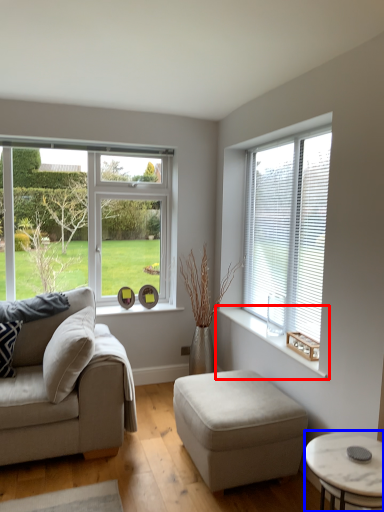
Question: Among these objects, which one is nearest to the camera, window sill (highlighted by a red box) or coffee table (highlighted by a blue box)?

Choices:
 (A) window sill
 (B) coffee table

Answer: (B)